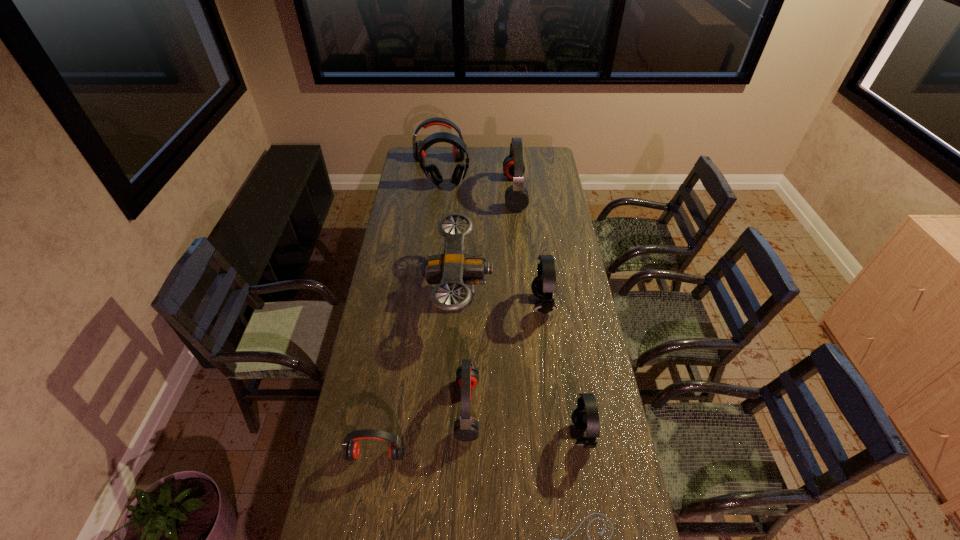
Find the location of a particular element. The width and height of the screenshot is (960, 540). free space located on the ear cups of the second smallest black earphone is located at coordinates (469, 304).

Where is `free location located 0.390m on the ear cups of the second smallest black earphone`? free location located 0.390m on the ear cups of the second smallest black earphone is located at coordinates (438, 304).

At what (x,y) coordinates should I click in order to perform the action: click on vacant area situated on the front-facing side of the yellow drone. Please return your answer as a coordinate pair (x, y). Looking at the image, I should click on (504, 289).

At what (x,y) coordinates should I click in order to perform the action: click on free spot located 0.370m on the ear cups of the second red earphone from right to left. Please return your answer as a coordinate pair (x, y). This screenshot has height=540, width=960. Looking at the image, I should click on (587, 408).

You are a GUI agent. You are given a task and a screenshot of the screen. Output one action in this format:
    pyautogui.click(x=<x>, y=<y>)
    Task: Click on the free space located 0.120m on the ear cups of the smallest black earphone
    This screenshot has height=540, width=960.
    Given the screenshot: What is the action you would take?
    pyautogui.click(x=535, y=434)

This screenshot has height=540, width=960. What are the coordinates of `free space located on the ear cups of the smallest black earphone` in the screenshot? It's located at (466, 434).

Locate an element on the screen. The width and height of the screenshot is (960, 540). vacant space located 0.160m on the ear cups of the smallest black earphone is located at coordinates (523, 434).

This screenshot has width=960, height=540. Find the location of `vacant space located 0.160m on the ear cups of the eighth tallest object`. vacant space located 0.160m on the ear cups of the eighth tallest object is located at coordinates (365, 519).

Identify the location of object that is at the far edge. (457, 154).

Where is `object at the far left corner`? The height and width of the screenshot is (540, 960). object at the far left corner is located at coordinates (457, 154).